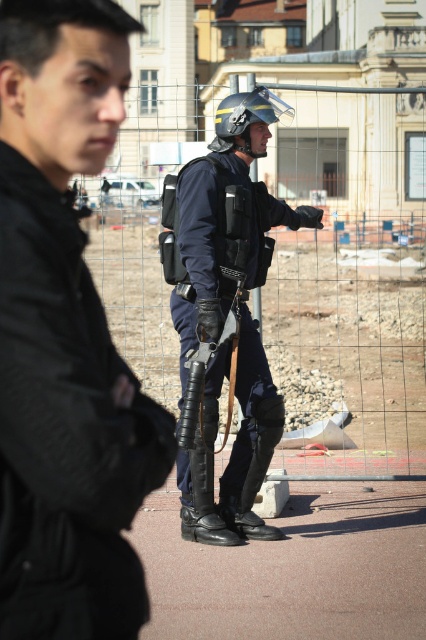
Question: Is black matte jacket at left above shiny black helmet at center?

Choices:
 (A) yes
 (B) no

Answer: (B)

Question: Which point appears closest to the camera in this image?

Choices:
 (A) 229,108
 (B) 190,445
 (C) 255,429
 (D) 89,492

Answer: (D)

Question: Does metal mesh fence at center lie in front of shiny black helmet at center?

Choices:
 (A) no
 (B) yes

Answer: (A)

Question: Among these objects, which one is nearest to the camera?

Choices:
 (A) black matte jacket at left
 (B) metal mesh fence at center
 (C) black matte uniform at center

Answer: (A)

Question: Which point appears farthest from the camera in this image?

Choices:
 (A) (98, 563)
 (B) (264, 115)
 (C) (305, 413)
 (D) (252, 524)

Answer: (C)

Question: Does metal mesh fence at center have a lesser width compared to shiny black helmet at center?

Choices:
 (A) no
 (B) yes

Answer: (A)